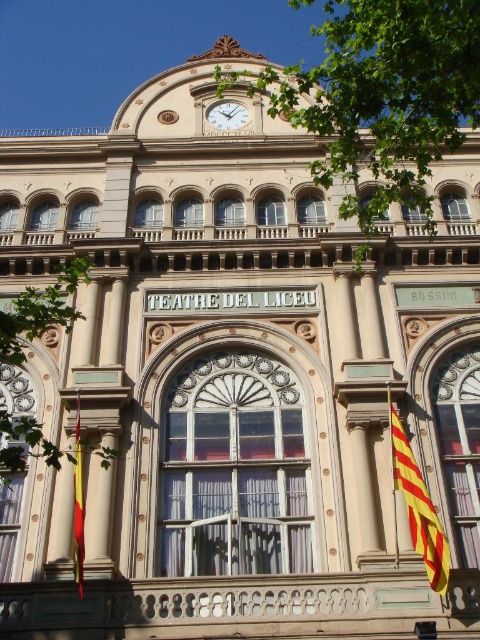
Is green leafy tree at upper center above yellow fabric flag at lower left?

Yes, green leafy tree at upper center is above yellow fabric flag at lower left.

Consider the image. Can you confirm if green leafy tree at upper center is bigger than yellow fabric flag at lower left?

Yes.

Where is `green leafy tree at upper center`? The width and height of the screenshot is (480, 640). green leafy tree at upper center is located at coordinates (382, 97).

Where is `green leafy tree at upper center`? The image size is (480, 640). green leafy tree at upper center is located at coordinates (382, 97).

Between green leafy tree at left and yellow fabric flag at lower left, which one is positioned higher?

green leafy tree at left is above.

Can you confirm if green leafy tree at left is taller than yellow fabric flag at lower left?

Yes, green leafy tree at left is taller than yellow fabric flag at lower left.

Locate an element on the screen. green leafy tree at left is located at coordinates point(39,310).

This screenshot has width=480, height=640. Identify the location of green leafy tree at left. (39, 310).

Is green leafy tree at upper center above yellowmaterial/textureflag at lower right?

Yes, green leafy tree at upper center is above yellowmaterial/textureflag at lower right.

Where is `green leafy tree at upper center`? green leafy tree at upper center is located at coordinates click(382, 97).

Is point (407, 150) positioned in front of point (414, 544)?

That is True.

The height and width of the screenshot is (640, 480). Identify the location of green leafy tree at upper center. (382, 97).